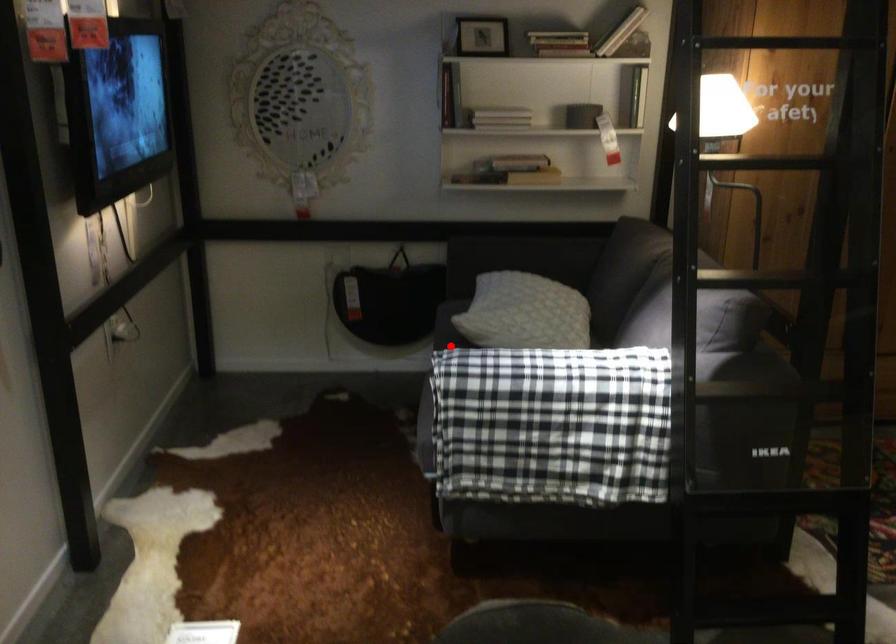
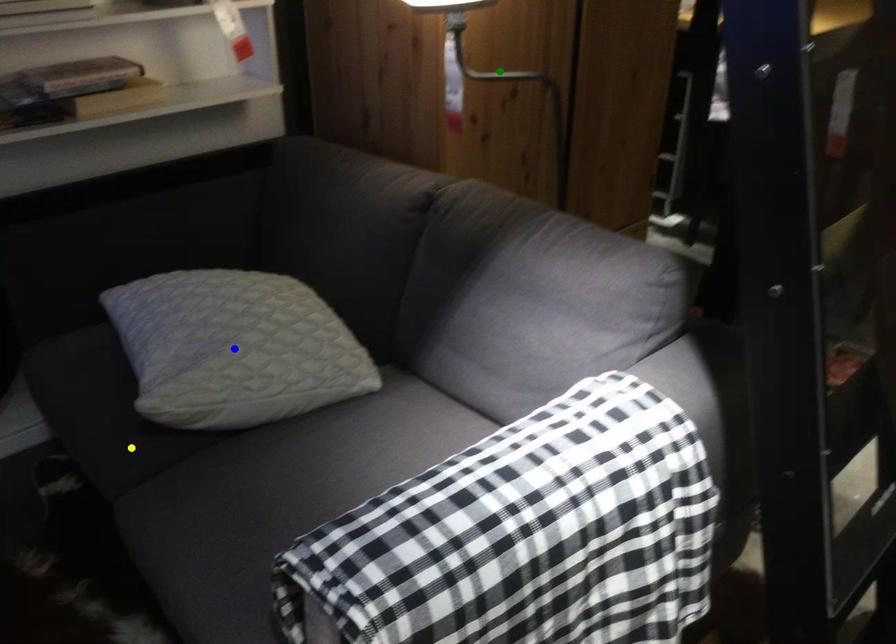
Question: I am providing you with two images of the same scene from different viewpoints. A red point is marked on the first image. You are given multiple points on the second image. In image 2, which mark is for the same physical point as the one in image 1?

Choices:
 (A) yellow point
 (B) green point
 (C) blue point

Answer: (A)